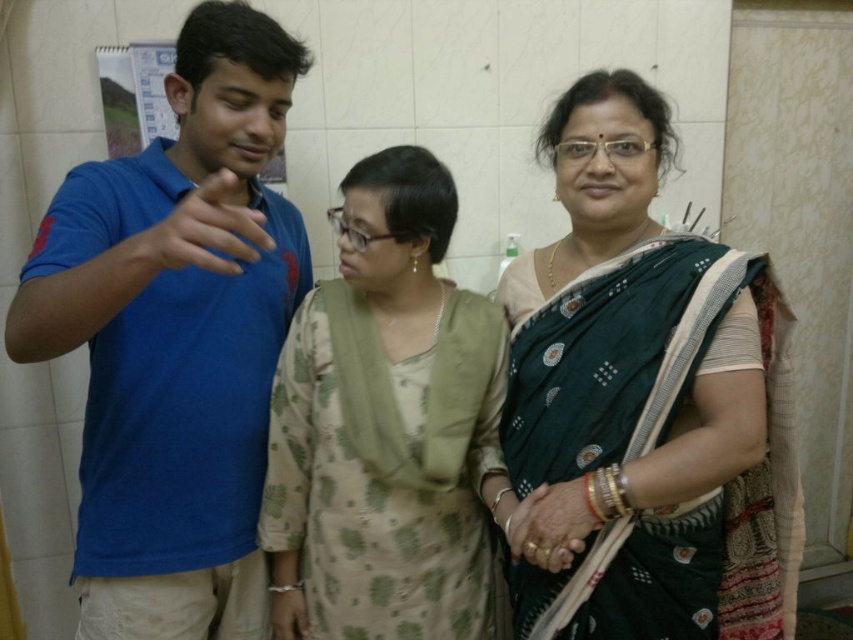
Between blue cotton shirt at left and beige floral dress at center, which one has more height?

Standing taller between the two is blue cotton shirt at left.

Is blue cotton shirt at left behind beige floral dress at center?

No, it is in front of beige floral dress at center.

Find the location of `blue cotton shirt at left`. blue cotton shirt at left is located at coordinates (177, 337).

Who is positioned more to the left, green silk saree at center or beige floral dress at center?

Positioned to the left is beige floral dress at center.

Describe the element at coordinates (645, 401) in the screenshot. I see `green silk saree at center` at that location.

You are a GUI agent. You are given a task and a screenshot of the screen. Output one action in this format:
    pyautogui.click(x=<x>, y=<y>)
    Task: Click on the green silk saree at center
    
    Given the screenshot: What is the action you would take?
    pyautogui.click(x=645, y=401)

Who is taller, green silk saree at center or blue cotton shirt at left?

blue cotton shirt at left is taller.

Which is below, green silk saree at center or blue cotton shirt at left?

Positioned lower is green silk saree at center.

Where is `green silk saree at center`? This screenshot has height=640, width=853. green silk saree at center is located at coordinates 645,401.